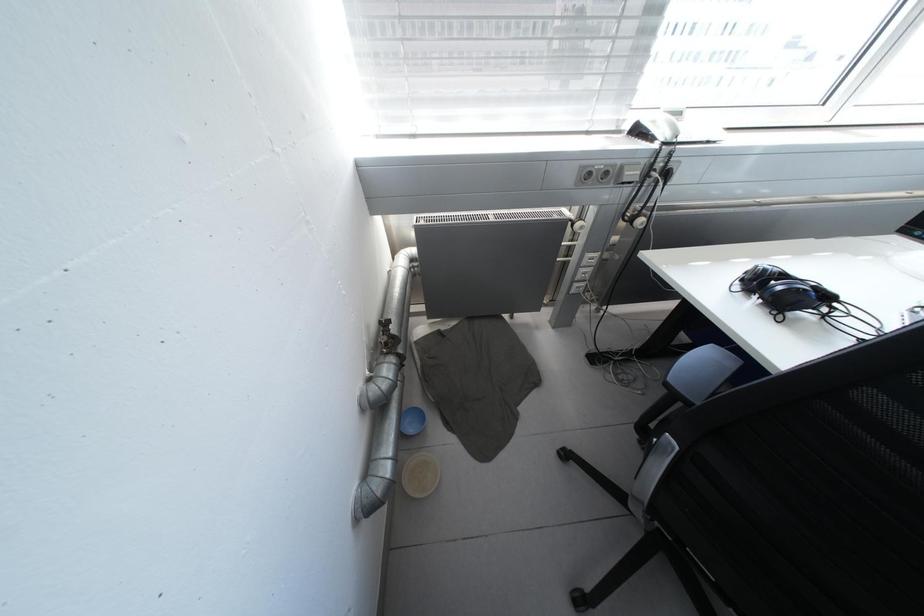
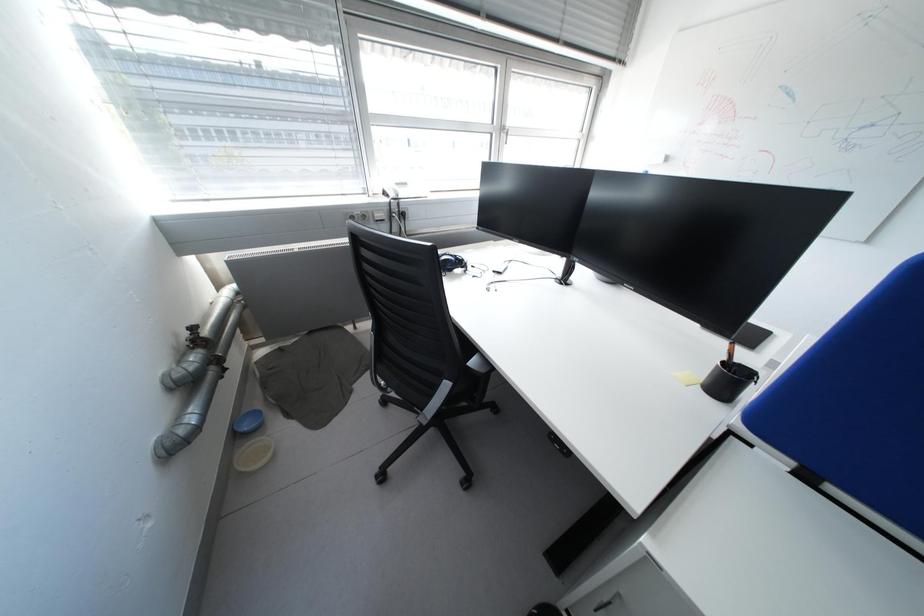
Question: Based on the continuous images, in which direction is the camera rotating? Reply with the corresponding letter.

Choices:
 (A) Left
 (B) Right
 (C) Up
 (D) Down

Answer: (B)